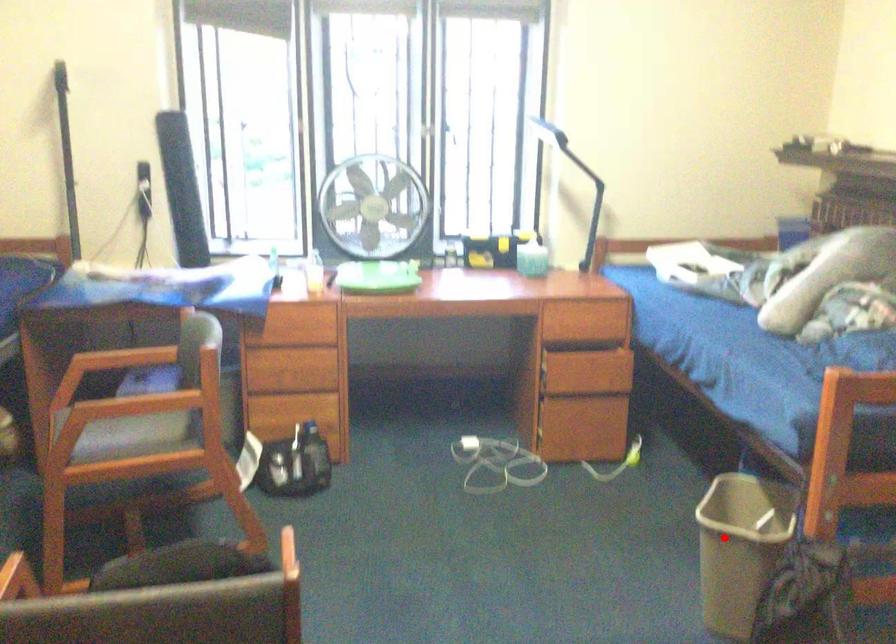
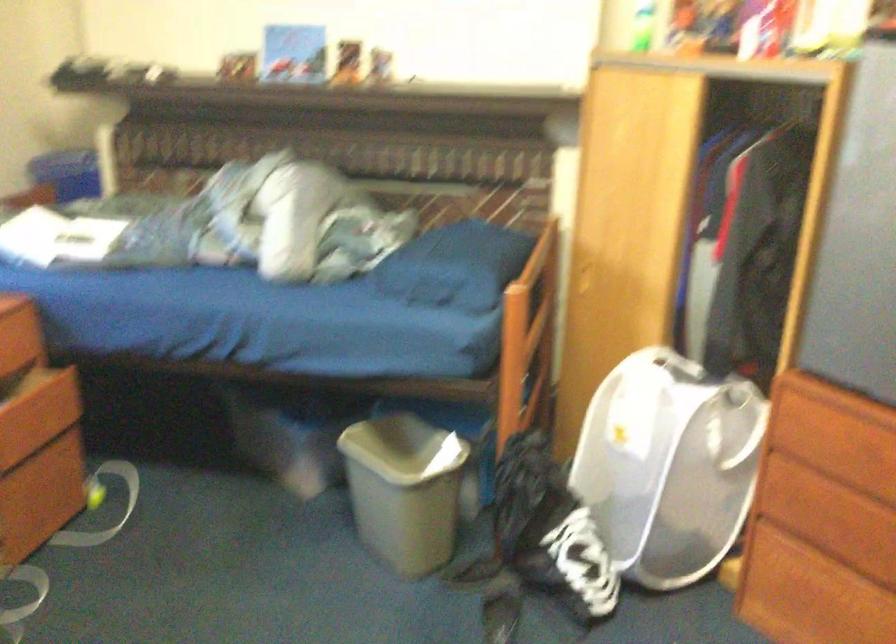
The point at the highlighted location is marked in the first image. Where is the corresponding point in the second image?

(403, 489)